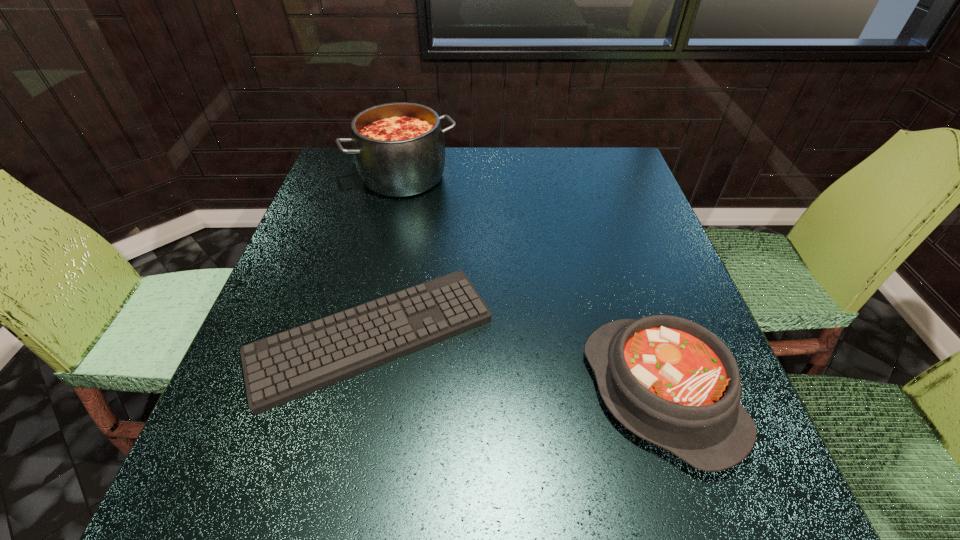
Select which object is the second closest to the computer keyboard. Please provide its 2D coordinates. Your answer should be formatted as a tuple, i.e. [(x, y)], where the tuple contains the x and y coordinates of a point satisfying the conditions above.

[(399, 150)]

I want to click on object that stands as the second closest to the nearer casserole, so click(x=399, y=150).

You are a GUI agent. You are given a task and a screenshot of the screen. Output one action in this format:
    pyautogui.click(x=<x>, y=<y>)
    Task: Click on the vacant position in the image that satisfies the following two spatial constraints: 1. on the front side of the second tallest object; 2. on the right side of the farther casserole
    The width and height of the screenshot is (960, 540).
    Given the screenshot: What is the action you would take?
    pyautogui.click(x=355, y=392)

The height and width of the screenshot is (540, 960). What are the coordinates of `blank space that satisfies the following two spatial constraints: 1. on the front side of the shortest object; 2. on the right side of the taller casserole` in the screenshot? It's located at (368, 336).

Locate an element on the screen. The image size is (960, 540). free location that satisfies the following two spatial constraints: 1. on the front side of the computer keyboard; 2. on the left side of the shorter casserole is located at coordinates (360, 392).